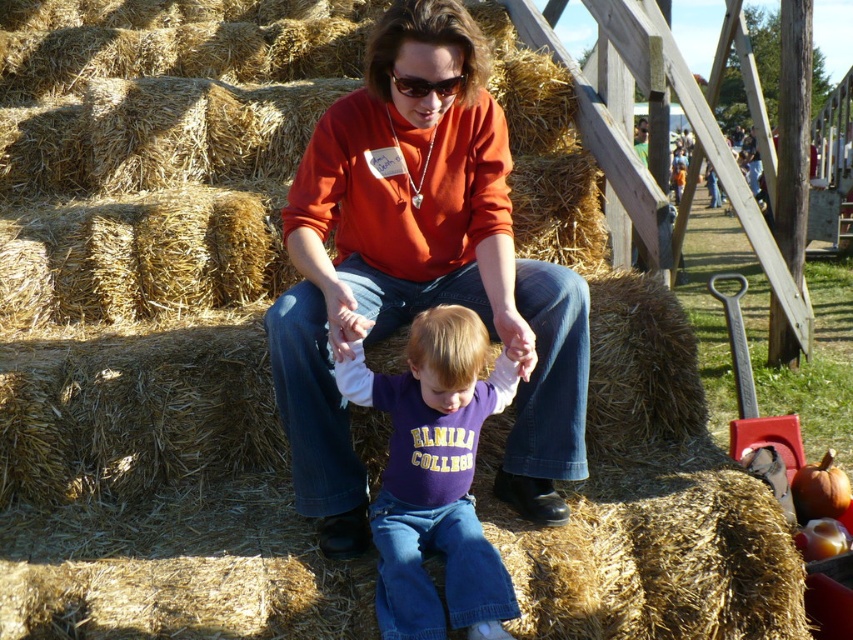
You are a photographer at the festival and want to take a picture of the purple cotton shirt at center and the matte black sunglasses at center. Which object is located to the left of the other?

The purple cotton shirt at center is positioned on the left side of matte black sunglasses at center.

You are a photographer at the festival and want to take a portrait of the purple cotton shirt at center and the matte black sunglasses at center. Since you want to ensure both are in focus, which object should you place your focus on first to account for their height difference?

The purple cotton shirt at center is much taller than the matte black sunglasses at center, so you should focus on the purple cotton shirt at center first to ensure both are in focus.